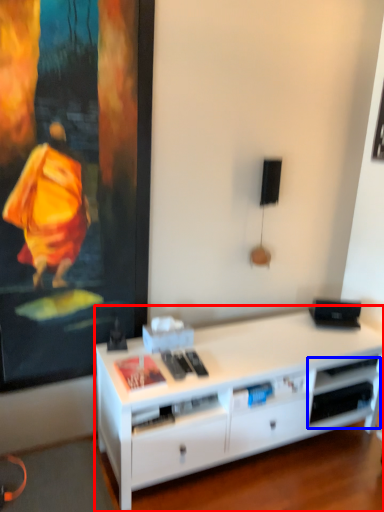
Question: Which point is further to the camera, desk (highlighted by a red box) or shelf (highlighted by a blue box)?

Choices:
 (A) desk
 (B) shelf

Answer: (B)